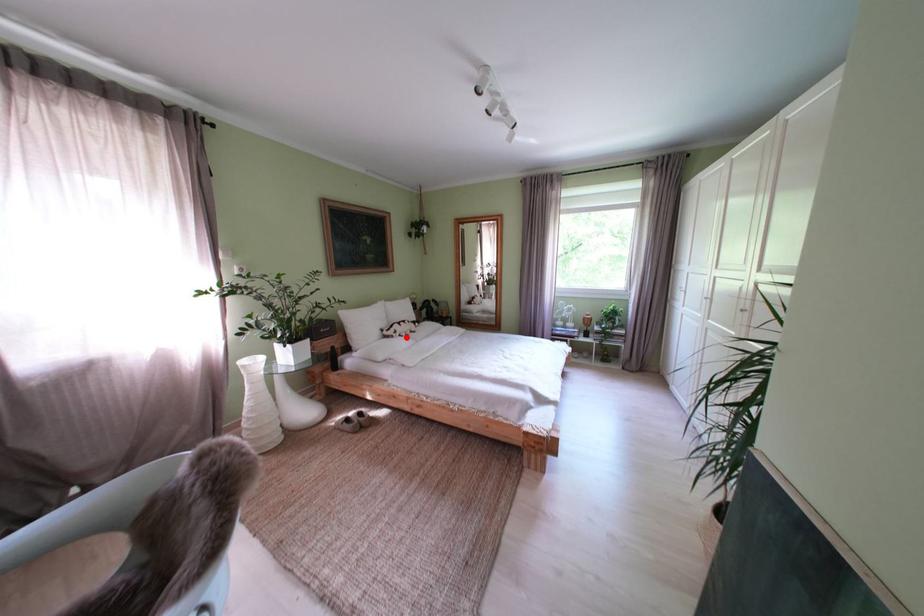
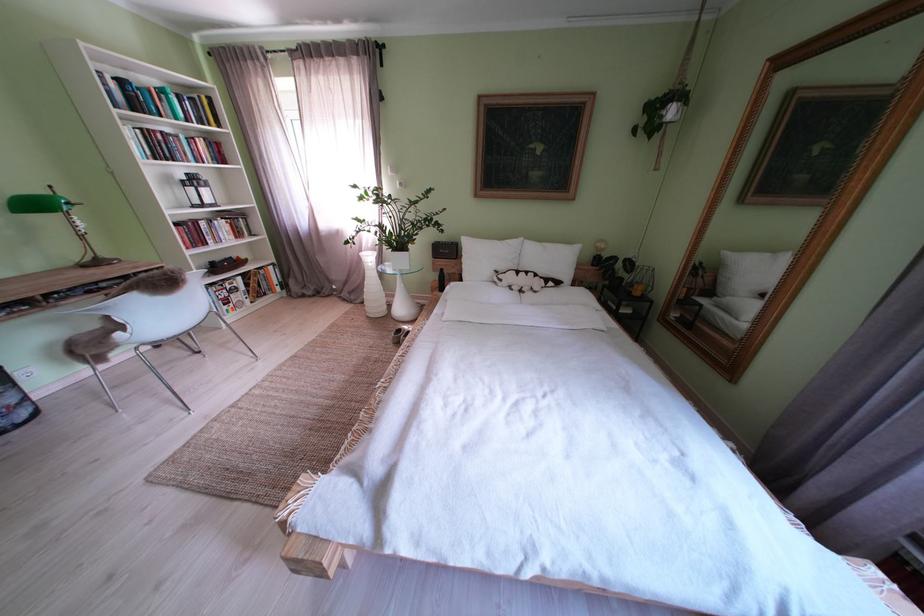
Find the pixel in the second image that matches the highlighted location in the first image.

(512, 285)